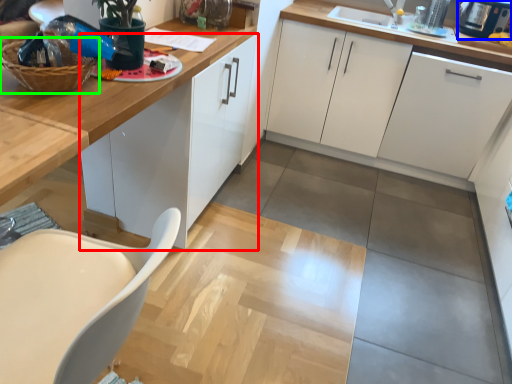
Question: Considering the real-world distances, which object is closest to cabinetry (highlighted by a red box)? appliance (highlighted by a blue box) or basket (highlighted by a green box).

Choices:
 (A) appliance
 (B) basket

Answer: (B)